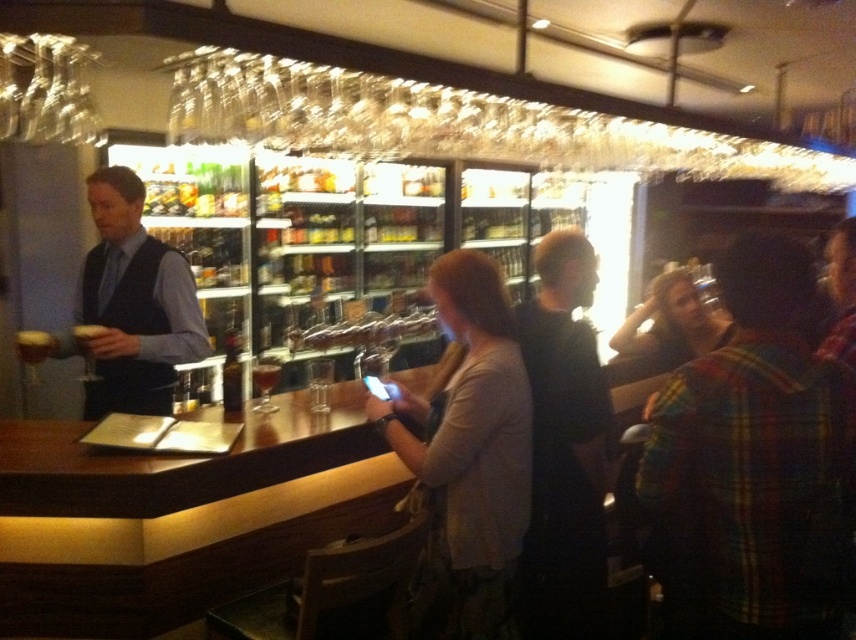
Question: Which of the following is the closest to the observer?

Choices:
 (A) transparent glass at bar
 (B) translucent glass at bar front

Answer: (B)

Question: Does clear glass wine glass at bar left appear on the right side of translucent glass at bar front?

Choices:
 (A) no
 (B) yes

Answer: (A)

Question: Does translucent glass wine glass at bar left have a lesser width compared to clear glass wine glass at bar left?

Choices:
 (A) yes
 (B) no

Answer: (B)

Question: Estimate the real-world distances between objects in this image. Which object is closer to the matte black vest at left?

Choices:
 (A) transparent glass at bar
 (B) clear glass wine glass at bar left

Answer: (B)

Question: Can you confirm if translucent glass wine glass at bar left is positioned below clear glass wine glass at bar left?

Choices:
 (A) yes
 (B) no

Answer: (A)

Question: Which point is closer to the camera taking this photo?

Choices:
 (A) (311, 403)
 (B) (156, 316)
 (C) (265, 397)

Answer: (C)